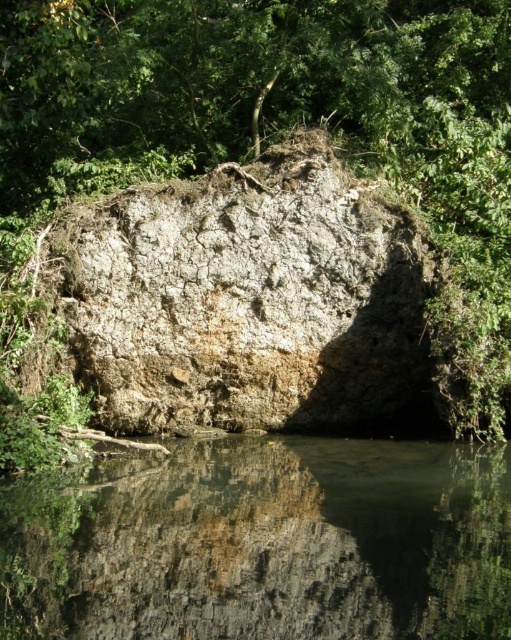
Question: Can you confirm if transparent water at center is bigger than gray rough rock at center?

Choices:
 (A) no
 (B) yes

Answer: (A)

Question: Which of the following is the farthest from the observer?

Choices:
 (A) gray rough rock at center
 (B) transparent water at center

Answer: (A)

Question: Where is transparent water at center located in relation to gray rough rock at center in the image?

Choices:
 (A) below
 (B) above

Answer: (A)

Question: Does transparent water at center have a greater width compared to gray rough rock at center?

Choices:
 (A) no
 (B) yes

Answer: (A)

Question: Among these points, which one is nearest to the camera?

Choices:
 (A) (181, 368)
 (B) (117, 502)

Answer: (B)